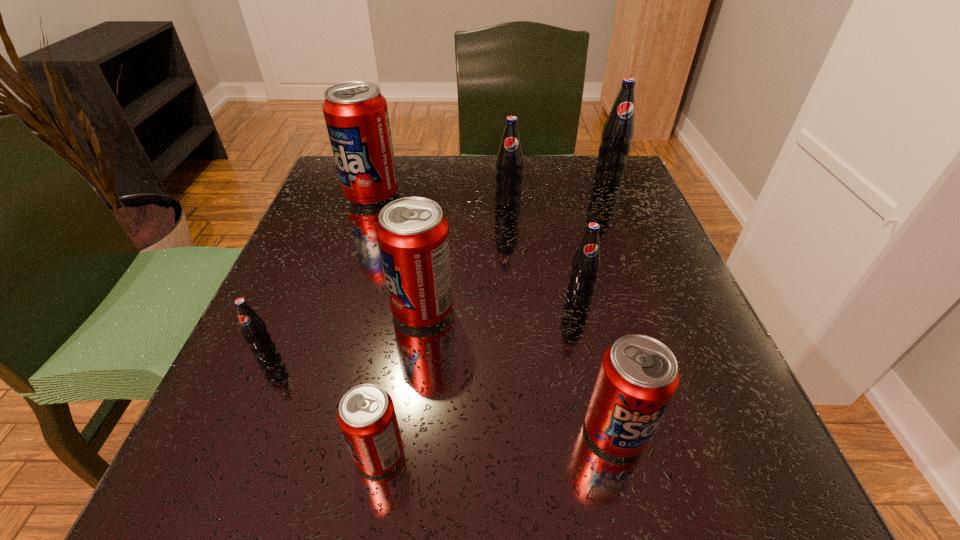
Locate an element on the screen. The height and width of the screenshot is (540, 960). unoccupied position between the second biggest red soda can and the second black pop from right to left is located at coordinates (501, 304).

Identify the location of free space between the rightmost black pop and the second biggest red soda can. Image resolution: width=960 pixels, height=540 pixels. (516, 245).

Find the location of a particular element. empty space between the second biggest red soda can and the fourth object from right to left is located at coordinates (466, 256).

You are a GUI agent. You are given a task and a screenshot of the screen. Output one action in this format:
    pyautogui.click(x=<x>, y=<y>)
    Task: Click on the free area in between the fourth soda can from right to left and the second soda can from left to right
    The height and width of the screenshot is (540, 960).
    Given the screenshot: What is the action you would take?
    pyautogui.click(x=440, y=199)

Where is `free space between the smallest red soda can and the second farthest red soda can`? The width and height of the screenshot is (960, 540). free space between the smallest red soda can and the second farthest red soda can is located at coordinates (401, 382).

Find the location of `free space between the third farthest black pop and the second smallest red soda can`. free space between the third farthest black pop and the second smallest red soda can is located at coordinates 597,364.

Image resolution: width=960 pixels, height=540 pixels. What are the coordinates of `blank region between the second farthest black pop and the smallest red soda can` in the screenshot? It's located at (444, 328).

Locate an element on the screen. The height and width of the screenshot is (540, 960). object that stands as the sixth closest to the smallest red soda can is located at coordinates pos(509,164).

Where is `object that is the second closest one to the smallest red soda can`? The image size is (960, 540). object that is the second closest one to the smallest red soda can is located at coordinates (253, 328).

Where is `soda can that stands as the second closest to the third nearest red soda can`? Image resolution: width=960 pixels, height=540 pixels. soda can that stands as the second closest to the third nearest red soda can is located at coordinates (366, 415).